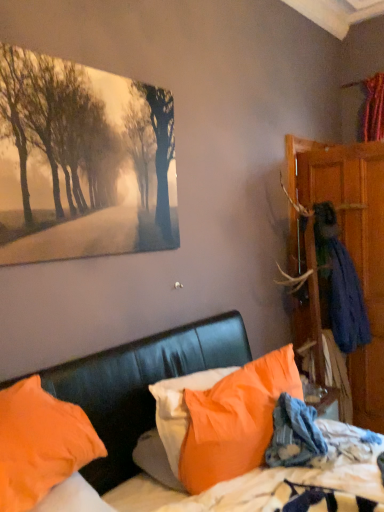
Question: Is blue fabric coat at right bigger than matte canvas painting at upper left?

Choices:
 (A) no
 (B) yes

Answer: (B)

Question: Is blue fabric coat at right not near matte canvas painting at upper left?

Choices:
 (A) no
 (B) yes

Answer: (B)

Question: Can you confirm if blue fabric coat at right is positioned to the left of matte canvas painting at upper left?

Choices:
 (A) yes
 (B) no

Answer: (B)

Question: Considering the relative sizes of blue fabric coat at right and matte canvas painting at upper left in the image provided, is blue fabric coat at right thinner than matte canvas painting at upper left?

Choices:
 (A) yes
 (B) no

Answer: (B)

Question: Considering the relative sizes of blue fabric coat at right and matte canvas painting at upper left in the image provided, is blue fabric coat at right shorter than matte canvas painting at upper left?

Choices:
 (A) yes
 (B) no

Answer: (B)

Question: From a real-world perspective, is wooden wardrobe at right above or below matte canvas painting at upper left?

Choices:
 (A) below
 (B) above

Answer: (A)

Question: From their relative heights in the image, would you say wooden wardrobe at right is taller or shorter than matte canvas painting at upper left?

Choices:
 (A) tall
 (B) short

Answer: (A)

Question: From the image's perspective, is wooden wardrobe at right above or below matte canvas painting at upper left?

Choices:
 (A) below
 (B) above

Answer: (A)

Question: Is wooden wardrobe at right in front of or behind matte canvas painting at upper left in the image?

Choices:
 (A) front
 (B) behind

Answer: (B)

Question: From a real-world perspective, is blue fabric coat at right positioned above or below wooden wardrobe at right?

Choices:
 (A) below
 (B) above

Answer: (A)

Question: Would you say blue fabric coat at right is to the left or to the right of wooden wardrobe at right in the picture?

Choices:
 (A) right
 (B) left

Answer: (B)

Question: Is blue fabric coat at right inside or outside of wooden wardrobe at right?

Choices:
 (A) inside
 (B) outside

Answer: (B)

Question: Considering their positions, is blue fabric coat at right located in front of or behind wooden wardrobe at right?

Choices:
 (A) front
 (B) behind

Answer: (B)

Question: Looking at the image, does blue fabric coat at right seem bigger or smaller compared to orange fabric pillow at center, which ranks as the 3th pillow in left-to-right order?

Choices:
 (A) small
 (B) big

Answer: (B)

Question: Based on their positions, is blue fabric coat at right located to the left or right of orange fabric pillow at center, positioned as the 1th pillow in right-to-left order?

Choices:
 (A) left
 (B) right

Answer: (B)